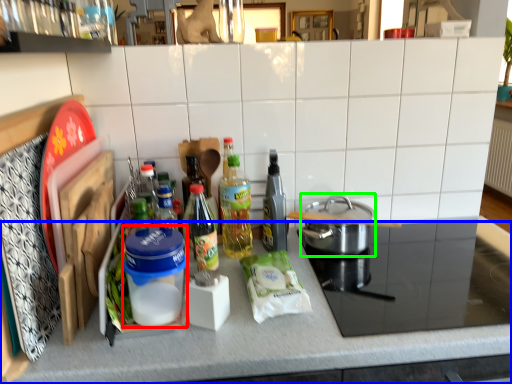
Question: Which is nearer to the appliance (highlighted by a red box)? countertop (highlighted by a blue box) or kitchen appliance (highlighted by a green box).

Choices:
 (A) countertop
 (B) kitchen appliance

Answer: (A)